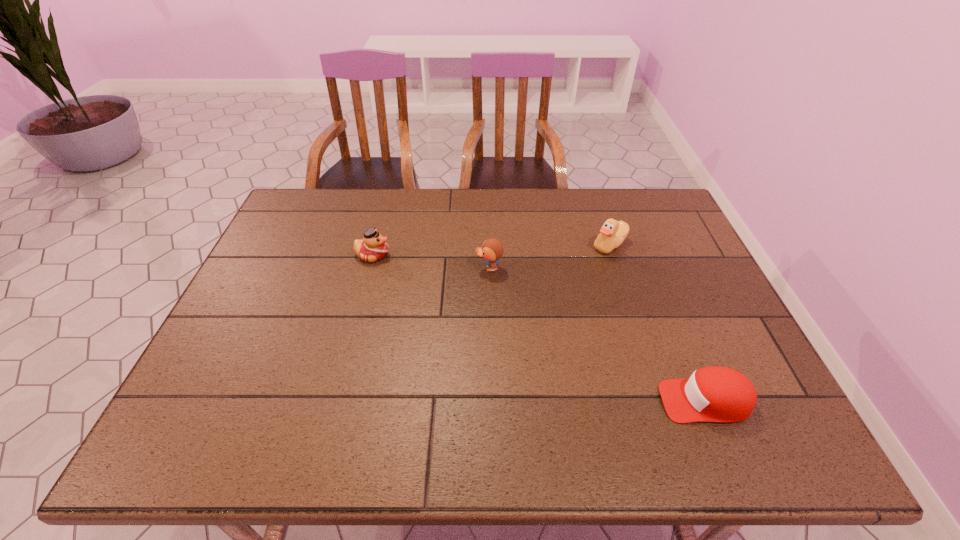
Locate an element on the screen. This screenshot has width=960, height=540. the rightmost duck is located at coordinates (613, 233).

Locate an element on the screen. the second object from left to right is located at coordinates (492, 249).

Locate an element on the screen. This screenshot has width=960, height=540. the leftmost duck is located at coordinates 373,247.

Find the location of a particular element. the nearest object is located at coordinates (712, 394).

Locate an element on the screen. This screenshot has width=960, height=540. baseball cap is located at coordinates (712, 394).

Find the location of a particular element. The height and width of the screenshot is (540, 960). vacant space situated at the beak of the rightmost duck is located at coordinates (473, 245).

Where is `vacant space located at the beak of the rightmost duck`? This screenshot has width=960, height=540. vacant space located at the beak of the rightmost duck is located at coordinates pyautogui.click(x=496, y=245).

Find the location of `vacant area located 0.120m at the beak of the rightmost duck`. vacant area located 0.120m at the beak of the rightmost duck is located at coordinates (x=552, y=245).

This screenshot has width=960, height=540. What are the coordinates of `free region located on the front-facing side of the second object from left to right` in the screenshot? It's located at (430, 268).

Locate an element on the screen. The image size is (960, 540). vacant position located on the front-facing side of the second object from left to right is located at coordinates (417, 268).